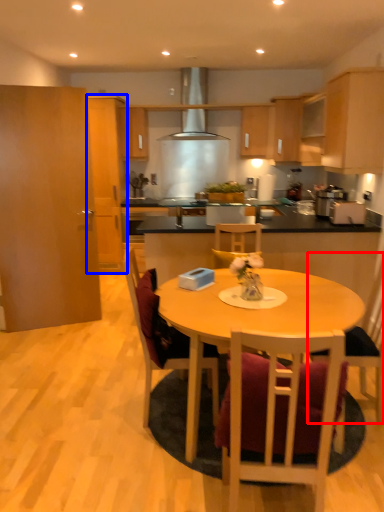
Question: Which point is closer to the camera, chair (highlighted by a red box) or cabinetry (highlighted by a blue box)?

Choices:
 (A) chair
 (B) cabinetry

Answer: (A)